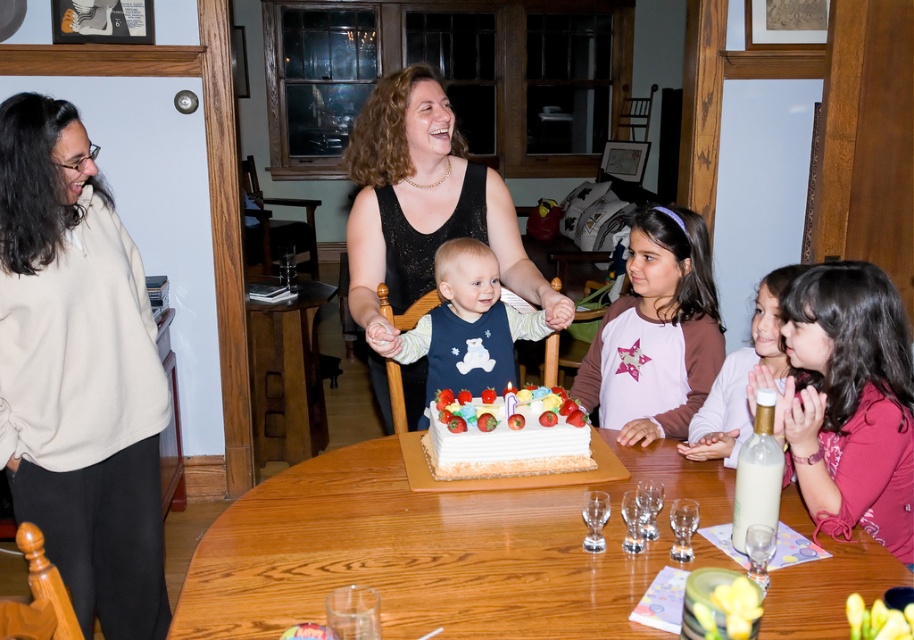
Question: Is wooden table at center smaller than pink satin dress at lower right?

Choices:
 (A) yes
 (B) no

Answer: (B)

Question: Which of the following is the farthest from the observer?

Choices:
 (A) click(x=528, y=442)
 (B) click(x=463, y=257)
 (C) click(x=177, y=618)

Answer: (B)

Question: Does white fleece sweater at left come in front of white frosted cake at center?

Choices:
 (A) yes
 (B) no

Answer: (A)

Question: Does wooden table at center come in front of brown wooden table at center?

Choices:
 (A) no
 (B) yes

Answer: (B)

Question: Based on their relative distances, which object is nearer to the wooden table at center?

Choices:
 (A) matte blue bib at center
 (B) brown wooden table at center
 (C) white frosted cake at center
 (D) black lace dress at center

Answer: (C)

Question: Which of these objects is positioned closest to the white fleece sweater at left?

Choices:
 (A) matte blue bib at center
 (B) wooden table at center
 (C) brown wooden table at center
 (D) white frosted cake at center

Answer: (A)